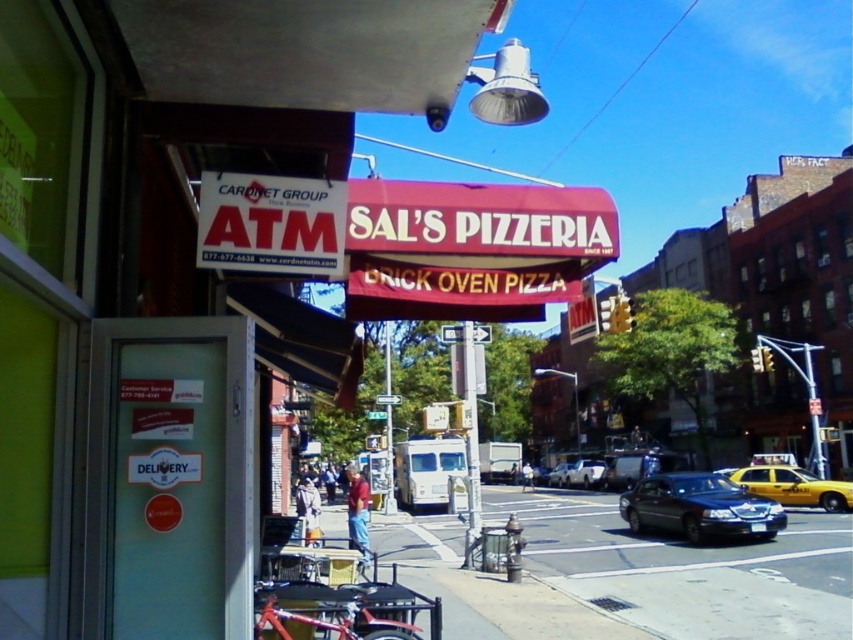
Is point (42, 353) in front of point (550, 483)?

Yes, it is.

Locate an element on the screen. The height and width of the screenshot is (640, 853). red brick oven pizza at center is located at coordinates (166, 278).

Describe the element at coordinates (793, 486) in the screenshot. I see `yellow matte taxi at lower right` at that location.

Which is behind, point (761, 477) or point (561, 470)?

The point (561, 470) is behind.

This screenshot has height=640, width=853. I want to click on yellow matte taxi at lower right, so click(x=793, y=486).

The image size is (853, 640). In order to click on yellow matte taxi at lower right in this screenshot , I will do `click(793, 486)`.

Who is taller, smooth asphalt road at center or white plastic atm at upper left?

Standing taller between the two is smooth asphalt road at center.

Between point (605, 570) and point (202, 240), which one is positioned in front?

Point (202, 240) is in front.

What do you see at coordinates (627, 573) in the screenshot? I see `smooth asphalt road at center` at bounding box center [627, 573].

Where is `smooth asphalt road at center`? smooth asphalt road at center is located at coordinates (627, 573).